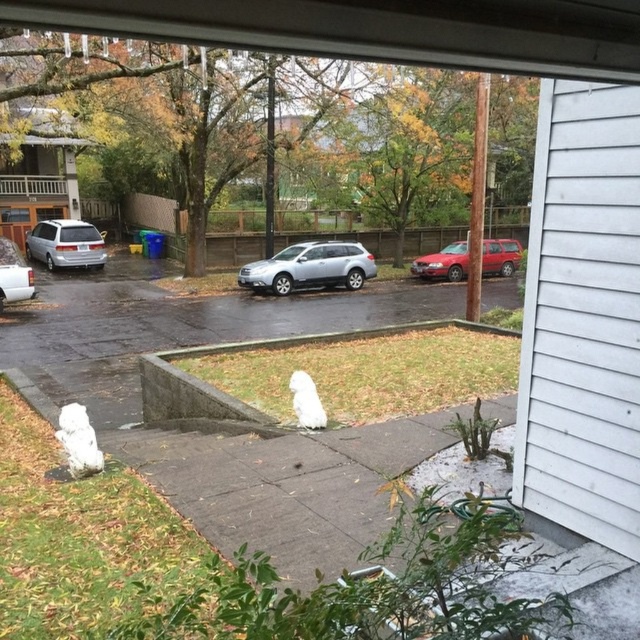
Is point (76, 465) positioned in front of point (307, 400)?

Yes.

At what (x,y) coordinates should I click in order to perform the action: click on white fluffy cloud at center. Please return your answer as a coordinate pair (x, y). The width and height of the screenshot is (640, 640). Looking at the image, I should click on (77, 440).

Find the location of a particular element. The image size is (640, 640). white fluffy cloud at center is located at coordinates (77, 440).

Find the location of a particular element. This screenshot has height=640, width=640. white fluffy cloud at center is located at coordinates (77, 440).

Between point (493, 300) and point (99, 257), which one is positioned behind?

The point (99, 257) is more distant.

What do you see at coordinates (193, 314) in the screenshot? I see `wet asphalt pavement at center` at bounding box center [193, 314].

Locate an element on the screen. wet asphalt pavement at center is located at coordinates (193, 314).

Between wet asphalt pavement at center and white fluffy cloud at center, which one has less height?

white fluffy cloud at center is shorter.

Is point (308, 323) positioned in front of point (93, 449)?

No, it is behind (93, 449).

Locate an element on the screen. wet asphalt pavement at center is located at coordinates (193, 314).